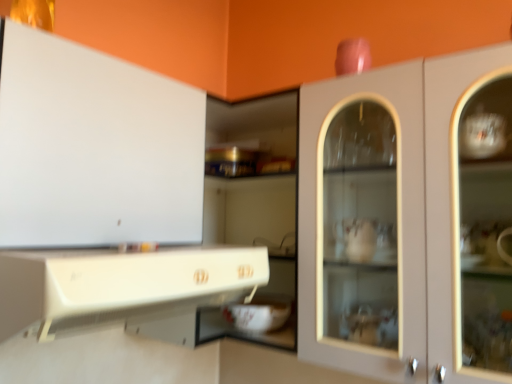
This screenshot has height=384, width=512. What do you see at coordinates (409, 220) in the screenshot?
I see `matte white cabinet at center, arranged as the third cabinetry when viewed from the left` at bounding box center [409, 220].

Find the location of a particular element. The image size is (512, 384). white glossy cabinet at upper left, the 3th cabinetry when ordered from right to left is located at coordinates (94, 148).

What is the approximate height of white glossy cabinet at lower left, which is the second cabinetry from left to right?

It is 5.96 inches.

Where is `matte white cabinet at center, the 1th cabinetry viewed from the right`? This screenshot has width=512, height=384. matte white cabinet at center, the 1th cabinetry viewed from the right is located at coordinates (409, 220).

Is matte white cabinet at center, arranged as the third cabinetry when viewed from the left, taller than white glossy cabinet at lower left, arranged as the 2th cabinetry when viewed from the right?

Indeed, matte white cabinet at center, arranged as the third cabinetry when viewed from the left, has a greater height compared to white glossy cabinet at lower left, arranged as the 2th cabinetry when viewed from the right.

Is matte white cabinet at center, arranged as the third cabinetry when viewed from the left, located outside white glossy cabinet at lower left, arranged as the 2th cabinetry when viewed from the right?

Absolutely, matte white cabinet at center, arranged as the third cabinetry when viewed from the left, is external to white glossy cabinet at lower left, arranged as the 2th cabinetry when viewed from the right.

Considering the positions of objects matte white cabinet at center, the 1th cabinetry viewed from the right, and white glossy cabinet at lower left, arranged as the 2th cabinetry when viewed from the right, in the image provided, who is in front, matte white cabinet at center, the 1th cabinetry viewed from the right, or white glossy cabinet at lower left, arranged as the 2th cabinetry when viewed from the right,?

white glossy cabinet at lower left, arranged as the 2th cabinetry when viewed from the right.

Which of these two, matte white cabinet at center, the 1th cabinetry viewed from the right, or white glossy cabinet at upper left, the 3th cabinetry when ordered from right to left, is bigger?

matte white cabinet at center, the 1th cabinetry viewed from the right, is bigger.

Which object is thinner, matte white cabinet at center, arranged as the third cabinetry when viewed from the left, or white glossy cabinet at upper left, which appears as the first cabinetry when viewed from the left?

white glossy cabinet at upper left, which appears as the first cabinetry when viewed from the left.

Is matte white cabinet at center, the 1th cabinetry viewed from the right, facing away from white glossy cabinet at upper left, which appears as the first cabinetry when viewed from the left?

No, white glossy cabinet at upper left, which appears as the first cabinetry when viewed from the left, is not at the back of matte white cabinet at center, the 1th cabinetry viewed from the right.

From the image's perspective, count 1st cabinetrys downward from the white glossy cabinet at upper left, the 3th cabinetry when ordered from right to left, and point to it. Please provide its 2D coordinates.

[(409, 220)]

Does point (26, 288) lie in front of point (408, 62)?

Yes, it is in front of point (408, 62).

Which object is closer to the camera taking this photo, white glossy cabinet at lower left, arranged as the 2th cabinetry when viewed from the right, or matte white cabinet at center, the 1th cabinetry viewed from the right?

white glossy cabinet at lower left, arranged as the 2th cabinetry when viewed from the right, is closer to the camera.

From the image's perspective, would you say white glossy cabinet at lower left, arranged as the 2th cabinetry when viewed from the right, is positioned over matte white cabinet at center, arranged as the third cabinetry when viewed from the left?

No, from the image's perspective, white glossy cabinet at lower left, arranged as the 2th cabinetry when viewed from the right, is not on top of matte white cabinet at center, arranged as the third cabinetry when viewed from the left.

What's the angular difference between white glossy cabinet at upper left, which appears as the first cabinetry when viewed from the left, and white glossy cabinet at lower left, arranged as the 2th cabinetry when viewed from the right,'s facing directions?

The facing directions of white glossy cabinet at upper left, which appears as the first cabinetry when viewed from the left, and white glossy cabinet at lower left, arranged as the 2th cabinetry when viewed from the right, are 0.779 degrees apart.

Who is smaller, white glossy cabinet at upper left, which appears as the first cabinetry when viewed from the left, or white glossy cabinet at lower left, which is the second cabinetry from left to right?

white glossy cabinet at lower left, which is the second cabinetry from left to right, is smaller.

Does white glossy cabinet at upper left, the 3th cabinetry when ordered from right to left, come in front of white glossy cabinet at lower left, arranged as the 2th cabinetry when viewed from the right?

No, white glossy cabinet at upper left, the 3th cabinetry when ordered from right to left, is behind white glossy cabinet at lower left, arranged as the 2th cabinetry when viewed from the right.

Is white glossy cabinet at upper left, which appears as the first cabinetry when viewed from the left, facing towards white glossy cabinet at lower left, which is the second cabinetry from left to right?

Yes, white glossy cabinet at upper left, which appears as the first cabinetry when viewed from the left, is facing white glossy cabinet at lower left, which is the second cabinetry from left to right.

Who is smaller, white glossy cabinet at lower left, arranged as the 2th cabinetry when viewed from the right, or white glossy cabinet at upper left, the 3th cabinetry when ordered from right to left?

white glossy cabinet at lower left, arranged as the 2th cabinetry when viewed from the right.

Who is shorter, white glossy cabinet at lower left, which is the second cabinetry from left to right, or white glossy cabinet at upper left, which appears as the first cabinetry when viewed from the left?

With less height is white glossy cabinet at lower left, which is the second cabinetry from left to right.

From a real-world perspective, is white glossy cabinet at upper left, which appears as the first cabinetry when viewed from the left, over matte white cabinet at center, the 1th cabinetry viewed from the right?

Actually, white glossy cabinet at upper left, which appears as the first cabinetry when viewed from the left, is physically below matte white cabinet at center, the 1th cabinetry viewed from the right, in the real world.

Based on the photo, which is closer, (x=89, y=228) or (x=320, y=309)?

Point (x=89, y=228) appears to be closer to the viewer than point (x=320, y=309).

Is white glossy cabinet at upper left, which appears as the first cabinetry when viewed from the left, with matte white cabinet at center, arranged as the third cabinetry when viewed from the left?

No, white glossy cabinet at upper left, which appears as the first cabinetry when viewed from the left, is not with matte white cabinet at center, arranged as the third cabinetry when viewed from the left.

Between white glossy cabinet at upper left, which appears as the first cabinetry when viewed from the left, and matte white cabinet at center, the 1th cabinetry viewed from the right, which one has larger width?

matte white cabinet at center, the 1th cabinetry viewed from the right.

Locate an element on the screen. cabinetry that is the 2nd object directly below the matte white cabinet at center, the 1th cabinetry viewed from the right (from a real-world perspective) is located at coordinates (120, 285).

This screenshot has width=512, height=384. I want to click on cabinetry that is the 1st one when counting downward from the white glossy cabinet at upper left, the 3th cabinetry when ordered from right to left (from the image's perspective), so click(x=409, y=220).

Based on their spatial positions, is matte white cabinet at center, the 1th cabinetry viewed from the right, or white glossy cabinet at lower left, arranged as the 2th cabinetry when viewed from the right, closer to white glossy cabinet at upper left, which appears as the first cabinetry when viewed from the left?

Among the two, white glossy cabinet at lower left, arranged as the 2th cabinetry when viewed from the right, is located nearer to white glossy cabinet at upper left, which appears as the first cabinetry when viewed from the left.

Looking at the image, which one is located closer to matte white cabinet at center, arranged as the third cabinetry when viewed from the left, white glossy cabinet at lower left, which is the second cabinetry from left to right, or white glossy cabinet at upper left, which appears as the first cabinetry when viewed from the left?

The object closer to matte white cabinet at center, arranged as the third cabinetry when viewed from the left, is white glossy cabinet at lower left, which is the second cabinetry from left to right.

When comparing their distances from matte white cabinet at center, arranged as the third cabinetry when viewed from the left, does white glossy cabinet at upper left, which appears as the first cabinetry when viewed from the left, or white glossy cabinet at lower left, which is the second cabinetry from left to right, seem closer?

white glossy cabinet at lower left, which is the second cabinetry from left to right.

Looking at the image, which one is located closer to white glossy cabinet at lower left, arranged as the 2th cabinetry when viewed from the right, white glossy cabinet at upper left, which appears as the first cabinetry when viewed from the left, or matte white cabinet at center, arranged as the third cabinetry when viewed from the left?

white glossy cabinet at upper left, which appears as the first cabinetry when viewed from the left, lies closer to white glossy cabinet at lower left, arranged as the 2th cabinetry when viewed from the right, than the other object.

Estimate the real-world distances between objects in this image. Which object is further from white glossy cabinet at lower left, which is the second cabinetry from left to right, matte white cabinet at center, arranged as the third cabinetry when viewed from the left, or white glossy cabinet at upper left, which appears as the first cabinetry when viewed from the left?

matte white cabinet at center, arranged as the third cabinetry when viewed from the left.

Which object lies further to the anchor point white glossy cabinet at upper left, which appears as the first cabinetry when viewed from the left, white glossy cabinet at lower left, arranged as the 2th cabinetry when viewed from the right, or matte white cabinet at center, the 1th cabinetry viewed from the right?

matte white cabinet at center, the 1th cabinetry viewed from the right, is positioned further to the anchor white glossy cabinet at upper left, which appears as the first cabinetry when viewed from the left.

At what (x,y) coordinates should I click in order to perform the action: click on cabinetry between white glossy cabinet at upper left, which appears as the first cabinetry when viewed from the left, and matte white cabinet at center, the 1th cabinetry viewed from the right, in the horizontal direction. Please return your answer as a coordinate pair (x, y). The width and height of the screenshot is (512, 384). Looking at the image, I should click on (120, 285).